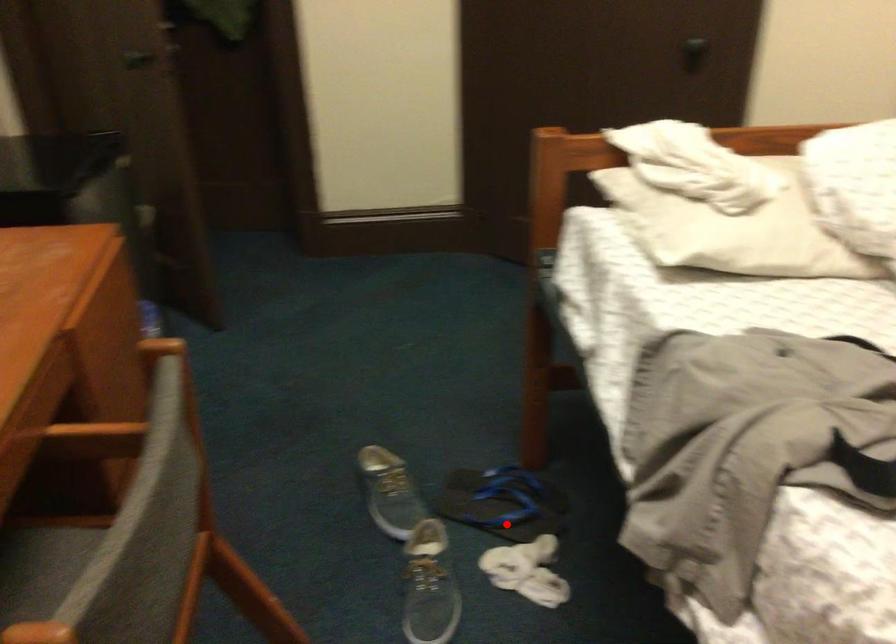
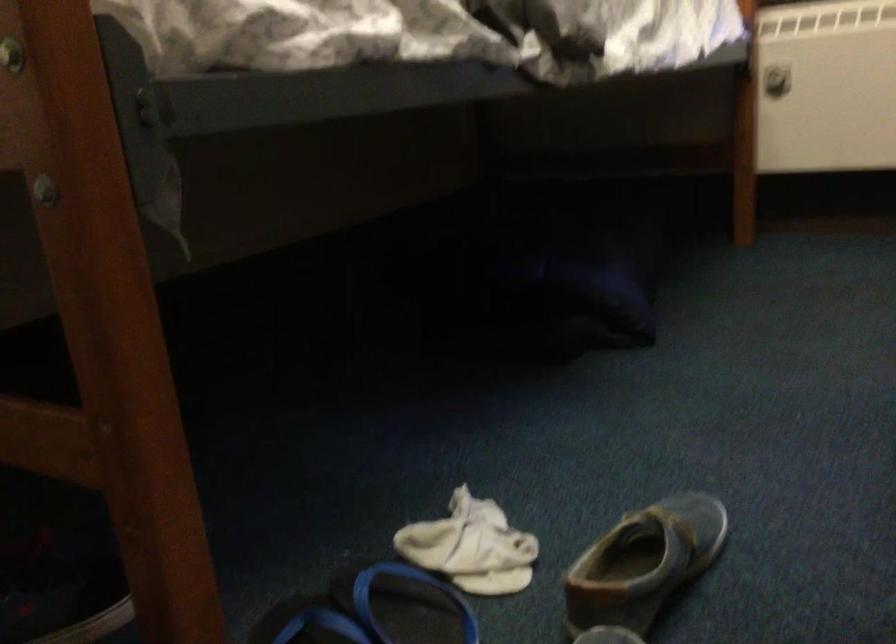
Question: I am providing you with two images of the same scene from different viewpoints. Image1 has a red point marked. In image2, the corresponding 3D location appears at what relative position? Reply with the corresponding letter.

Choices:
 (A) Closer
 (B) Farther

Answer: (A)